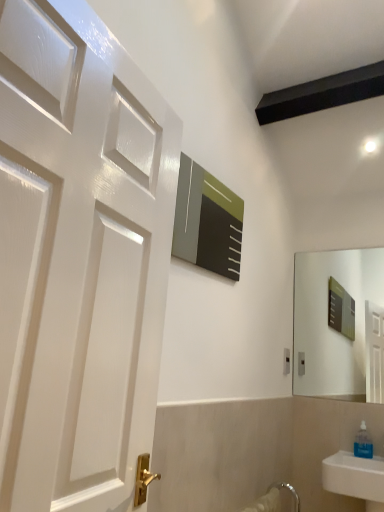
Question: From a real-world perspective, is transparent plastic soap dispenser at lower right physically below white plastic electric outlet at upper right?

Choices:
 (A) yes
 (B) no

Answer: (A)

Question: Would you say transparent plastic soap dispenser at lower right is outside white plastic electric outlet at upper right?

Choices:
 (A) no
 (B) yes

Answer: (B)

Question: Is transparent plastic soap dispenser at lower right smaller than white plastic electric outlet at upper right?

Choices:
 (A) yes
 (B) no

Answer: (B)

Question: Is transparent plastic soap dispenser at lower right positioned in front of white plastic electric outlet at upper right?

Choices:
 (A) no
 (B) yes

Answer: (B)

Question: Is transparent plastic soap dispenser at lower right bigger than white plastic electric outlet at upper right?

Choices:
 (A) no
 (B) yes

Answer: (B)

Question: Can you confirm if transparent plastic soap dispenser at lower right is shorter than white plastic electric outlet at upper right?

Choices:
 (A) yes
 (B) no

Answer: (B)

Question: Considering the relative sizes of white plastic electric outlet at upper right and transparent plastic soap dispenser at lower right in the image provided, is white plastic electric outlet at upper right taller than transparent plastic soap dispenser at lower right?

Choices:
 (A) no
 (B) yes

Answer: (A)

Question: Are white plastic electric outlet at upper right and transparent plastic soap dispenser at lower right far apart?

Choices:
 (A) yes
 (B) no

Answer: (B)

Question: Does white plastic electric outlet at upper right have a larger size compared to transparent plastic soap dispenser at lower right?

Choices:
 (A) yes
 (B) no

Answer: (B)

Question: Is white plastic electric outlet at upper right turned away from transparent plastic soap dispenser at lower right?

Choices:
 (A) no
 (B) yes

Answer: (A)

Question: From the image's perspective, is white plastic electric outlet at upper right above transparent plastic soap dispenser at lower right?

Choices:
 (A) no
 (B) yes

Answer: (B)

Question: Would you say white plastic electric outlet at upper right contains transparent plastic soap dispenser at lower right?

Choices:
 (A) yes
 (B) no

Answer: (B)

Question: Is white plastic electric outlet at upper right situated inside transparent plastic soap dispenser at lower right or outside?

Choices:
 (A) outside
 (B) inside

Answer: (A)